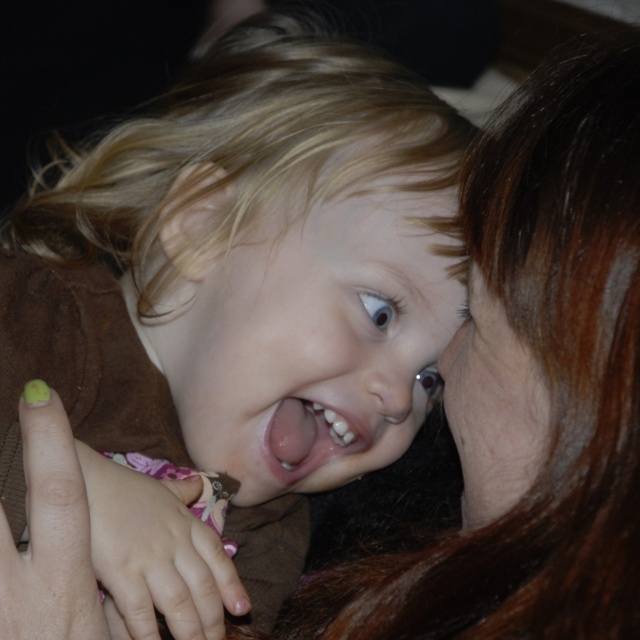
You are a photographer trying to capture a portrait of the child. You notice the blonde hair at center and smooth skin face at center. Which object should you adjust to ensure the face is fully visible?

The blonde hair at center is in front of the smooth skin face at center, so you should adjust the blonde hair at center to move it away from the face to ensure the smooth skin face at center is fully visible.